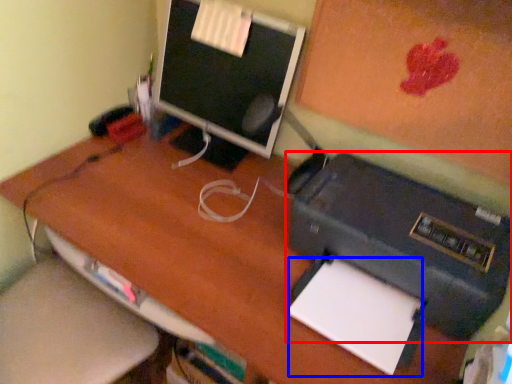
Question: Which object appears farthest to the camera in this image, printer (highlighted by a red box) or notepad (highlighted by a blue box)?

Choices:
 (A) printer
 (B) notepad

Answer: (B)